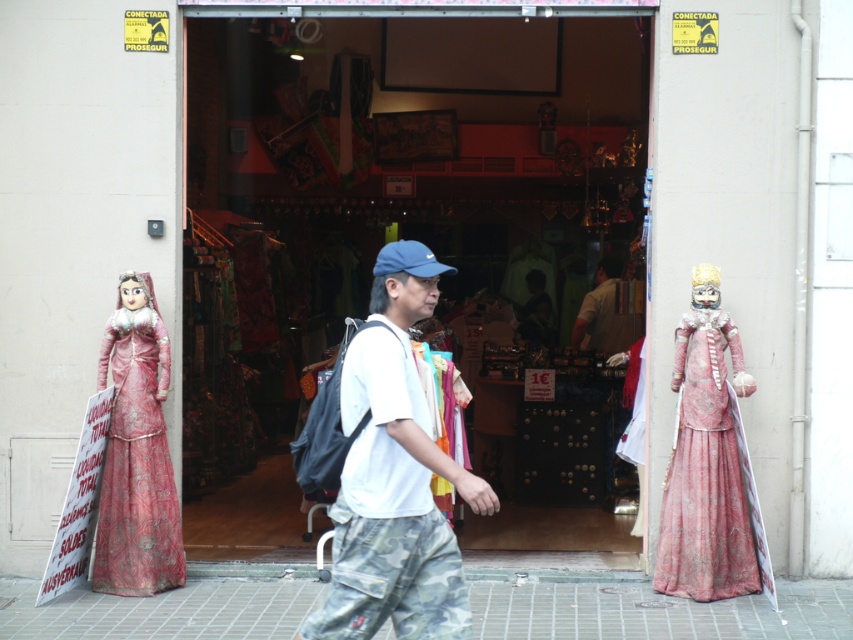
Question: Which point appears closest to the camera in this image?

Choices:
 (A) (357, 358)
 (B) (846, 602)
 (C) (711, 328)
 (D) (196, 346)

Answer: (A)

Question: Is matte glass shop window at center above matte beige shirt at center?

Choices:
 (A) no
 (B) yes

Answer: (B)

Question: Which of the following is the farthest from the observer?

Choices:
 (A) matte pink fabric dress at right
 (B) brick pavement at center
 (C) matte glass shop window at center
 (D) matte pink fabric dress at left

Answer: (C)

Question: Can you confirm if brick pavement at center is positioned to the left of matte pink fabric dress at right?

Choices:
 (A) yes
 (B) no

Answer: (A)

Question: Is brick pavement at center smaller than matte pink fabric dress at right?

Choices:
 (A) no
 (B) yes

Answer: (B)

Question: Among these objects, which one is farthest from the camera?

Choices:
 (A) matte pink fabric dress at right
 (B) brick pavement at center
 (C) matte beige shirt at center
 (D) matte pink fabric dress at left

Answer: (C)